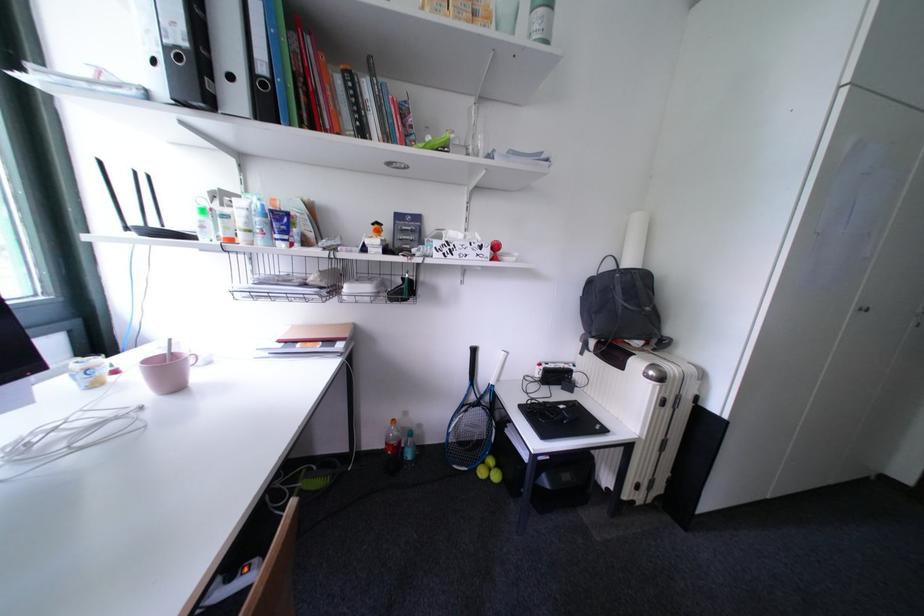
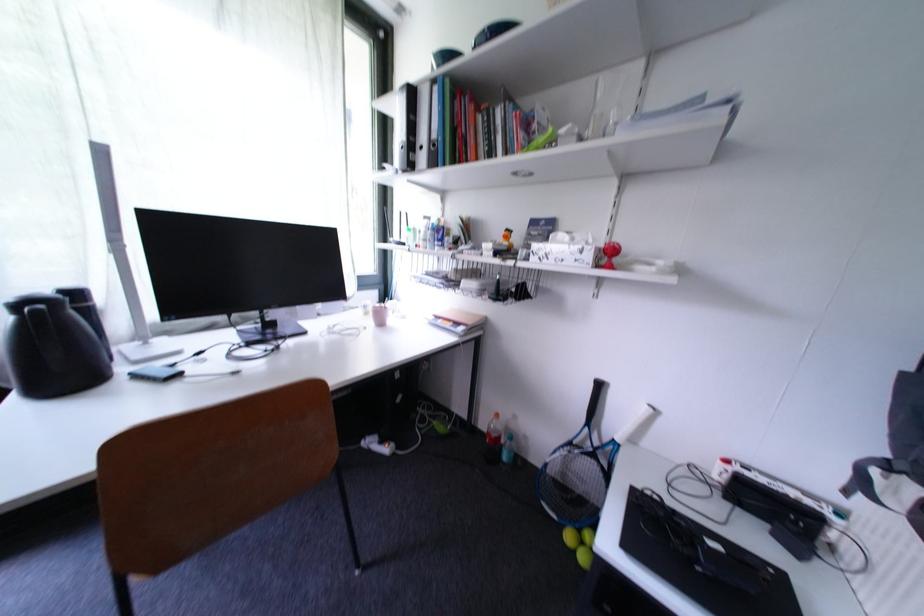
In the second image, find the point that corresponds to (x=103, y=387) in the first image.

(373, 315)